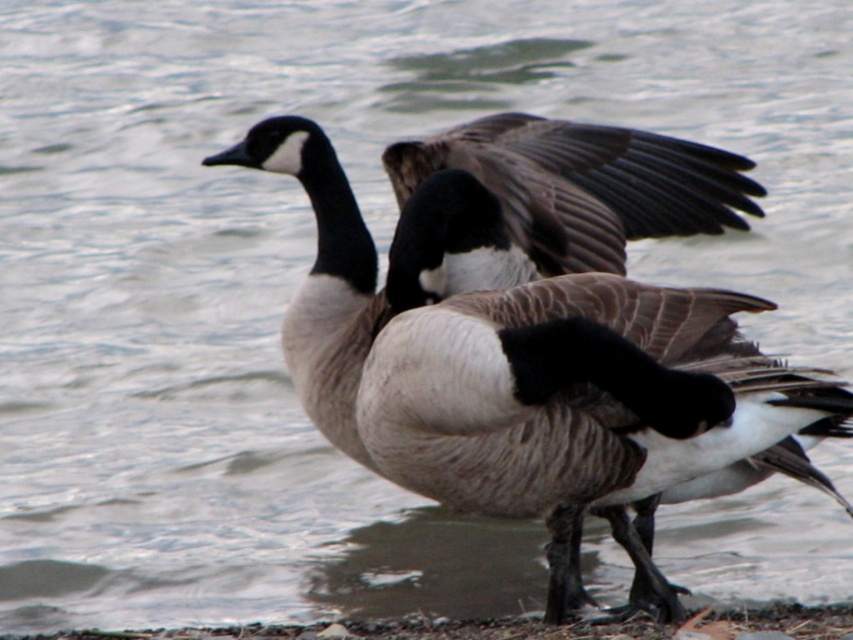
Does brown feathered duck at center appear on the right side of dark gray feathered wing at center?

Indeed, brown feathered duck at center is positioned on the right side of dark gray feathered wing at center.

Which of these two, brown feathered duck at center or dark gray feathered wing at center, stands shorter?

dark gray feathered wing at center is shorter.

The height and width of the screenshot is (640, 853). Find the location of `brown feathered duck at center`. brown feathered duck at center is located at coordinates (525, 380).